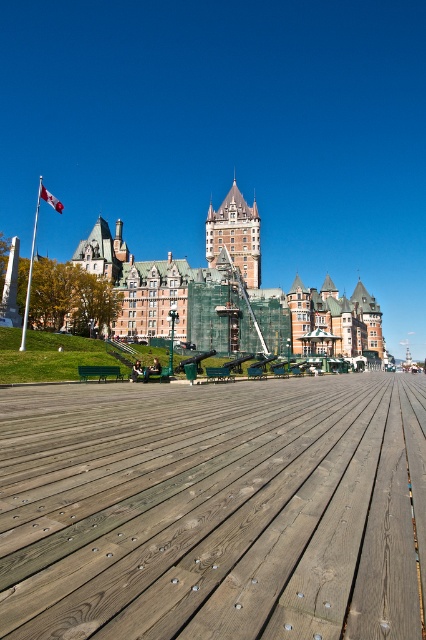
You are a tourist standing on the wooden boardwalk and want to take a photo of both the orange brick building at center and the white fabric flag at upper left. Which object should you focus on first to ensure both are in frame?

You should focus on the orange brick building at center first because it is larger than the white fabric flag at upper left, so it will take up more space in the photo and help frame the composition better.

You are a photographer planning to capture the orange brick building at center and the white fabric flag at upper left in the same frame. Based on their sizes, which object should you focus on first to ensure both are clearly visible in the photo?

The orange brick building at center is wider than the white fabric flag at upper left, so focusing on the orange brick building at center first will help ensure both fit clearly in the frame.